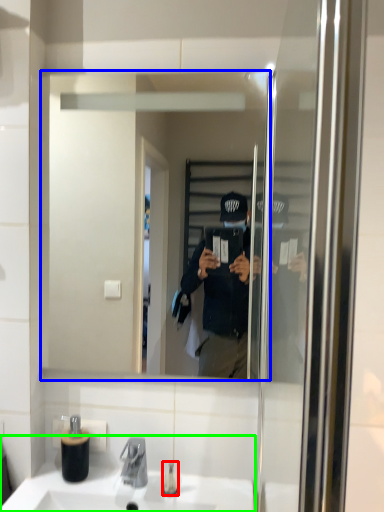
Question: Based on their relative distances, which object is nearer to toiletry (highlighted by a red box)? Choose from mirror (highlighted by a blue box) and sink (highlighted by a green box).

Choices:
 (A) mirror
 (B) sink

Answer: (B)